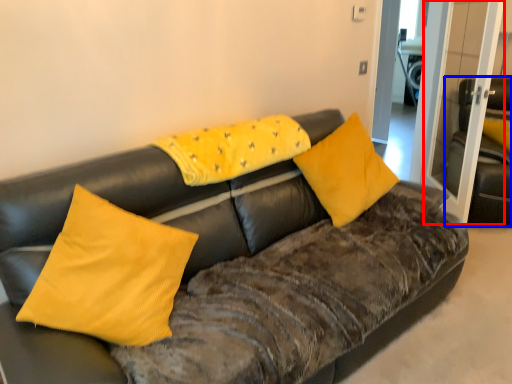
Question: Which object is further to the camera taking this photo, glass door (highlighted by a red box) or armchair (highlighted by a blue box)?

Choices:
 (A) glass door
 (B) armchair

Answer: (B)